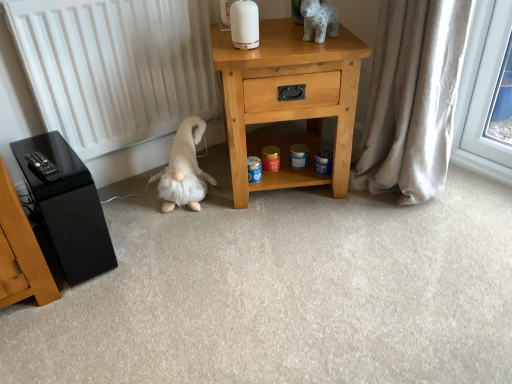
Where is `vacant area that is in front of fluffy white plush at lower left, which ranks as the 1th animal in back-to-front order`? This screenshot has width=512, height=384. vacant area that is in front of fluffy white plush at lower left, which ranks as the 1th animal in back-to-front order is located at coordinates (176, 231).